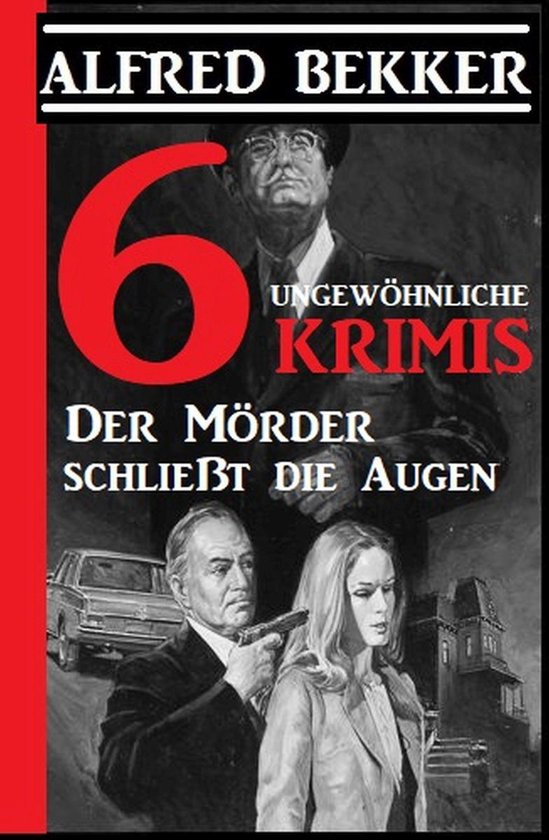
Locate an element on the screen. This screenshot has height=840, width=549. stairs is located at coordinates (452, 759).